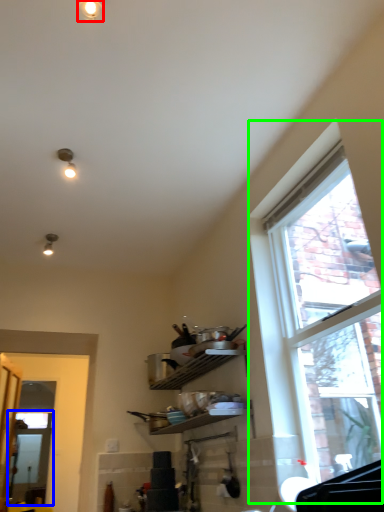
Question: Which object is positioned closest to light fixture (highlighted by a red box)? Select from screen door (highlighted by a blue box) and window (highlighted by a green box).

Choices:
 (A) screen door
 (B) window

Answer: (B)